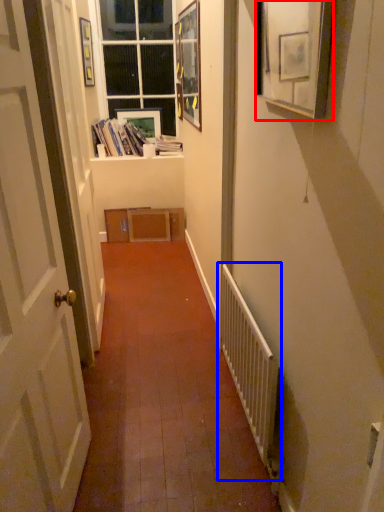
Question: Which point is closer to the camera, picture frame (highlighted by a red box) or radiator (highlighted by a blue box)?

Choices:
 (A) picture frame
 (B) radiator

Answer: (A)